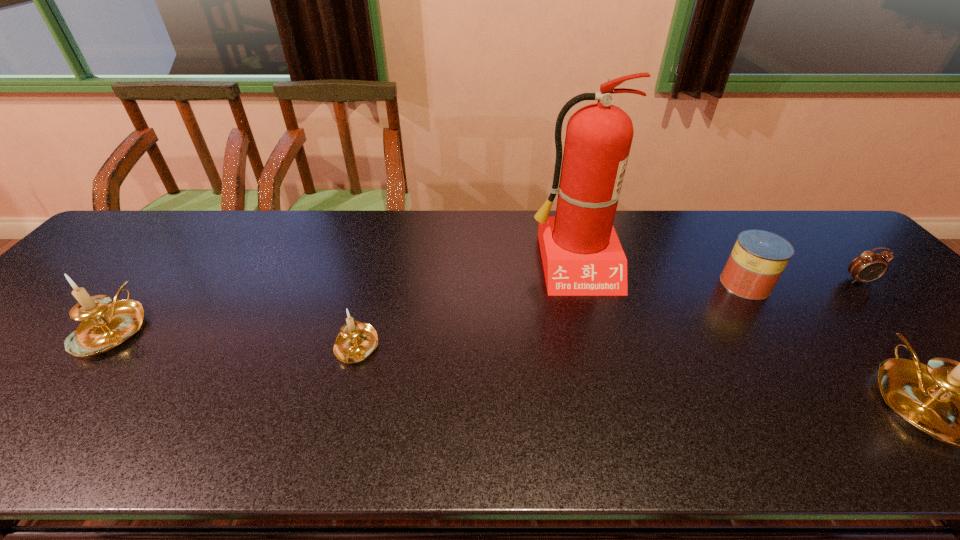
This screenshot has height=540, width=960. In order to click on vacant space located 0.370m on the handle side of the third tallest object in this screenshot , I will do `click(205, 219)`.

Identify the location of vacant area situated 0.080m on the handle side of the second candle holder from right to left. (341, 406).

Locate an element on the screen. vacant space located 0.120m on the left of the third object from right to left is located at coordinates (677, 284).

Find the location of a particular element. vacant space located on the front-facing side of the tallest object is located at coordinates (588, 323).

The width and height of the screenshot is (960, 540). I want to click on vacant space located 0.180m on the face of the alarm clock, so click(x=913, y=335).

I want to click on object at the far edge, so click(581, 254).

Identify the location of object that is at the left edge. The width and height of the screenshot is (960, 540). (105, 325).

This screenshot has height=540, width=960. I want to click on object that is at the right edge, so click(x=869, y=266).

Where is `free space at the far edge of the desktop`? This screenshot has width=960, height=540. free space at the far edge of the desktop is located at coordinates (213, 215).

The height and width of the screenshot is (540, 960). Identify the location of vacant region at the near edge of the desktop. (418, 402).